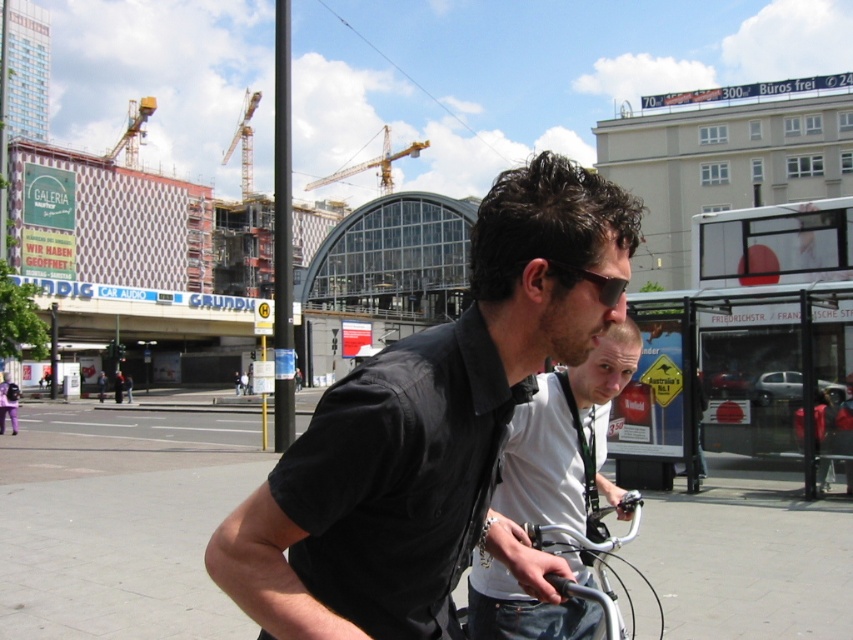
You are a pedestrian standing at the crosswalk and see the black matte shirt at center and the metallic construction crane at upper center in the scene. Which object is closer to you?

The black matte shirt at center is closer to you because it is in front of the metallic construction crane at upper center.

You are a photographer trying to capture a photo of the two cyclists in the urban scene. Since you want to focus on the person in the black matte shirt at center, where should you position them relative to the matte black shirt at center in your frame?

The black matte shirt at center should be placed on the left side of the matte black shirt at center in your frame to ensure proper positioning as described.

You are a pedestrian standing at the edge of the road in this urban scene. You notice two items worn by the cyclist in the foreground. Which item is positioned lower on the cyclist? The options are the black matte shirt at center and the black matte sunglasses at center.

The black matte shirt at center is located below the black matte sunglasses at center, so the shirt is positioned lower on the cyclist.